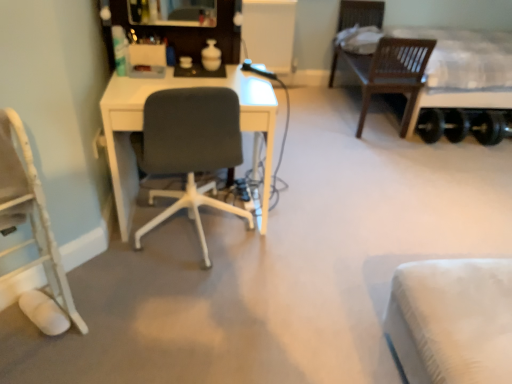
Where is `vacant space behind white fabric chair at lower left, the 2th chair when ordered from right to left`? vacant space behind white fabric chair at lower left, the 2th chair when ordered from right to left is located at coordinates (84, 287).